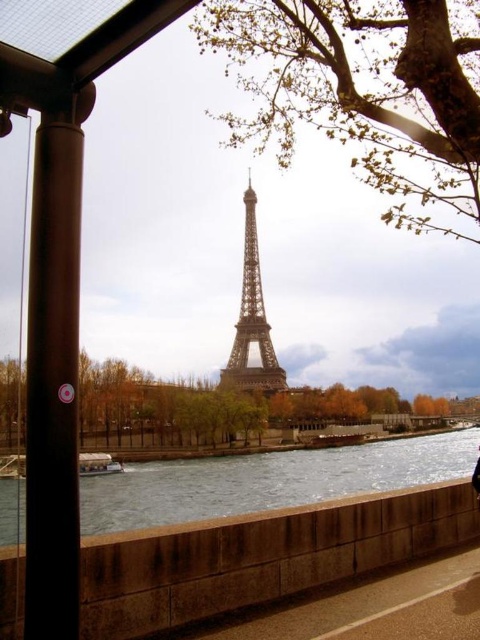
You are standing on the walkway at the bottom right of the image and want to take a photo of the shiny metallic Eiffel Tower at center. However, there is a black fabric person at lower right blocking your view. Can you move to the left to get a clear shot of the Eiffel Tower without the person in the frame?

The shiny metallic Eiffel Tower at center is much larger than the black fabric person at lower right, so moving to the left should allow you to position yourself where the person is no longer blocking the view of the tower.

You are a photographer planning to take a picture of the shiny metallic Eiffel Tower at center. You notice a black polished metal pole at left in the frame. Considering their thickness, which object would appear more slender in your photo?

The black polished metal pole at left would appear more slender in the photo because it is thinner than the shiny metallic Eiffel Tower at center.

You are standing at the point marked by coordinates point (x=160, y=513) and want to take a photo of the Eiffel Tower. The camera you are using has a maximum zoom range of 100 meters. Will you be able to capture the entire Eiffel Tower in your photo without moving closer?

The distance between you at point (x=160, y=513) and the viewer is 193.35 meters. Since the camera can only zoom up to 100 meters, you will not be able to capture the entire Eiffel Tower in your photo without moving closer.